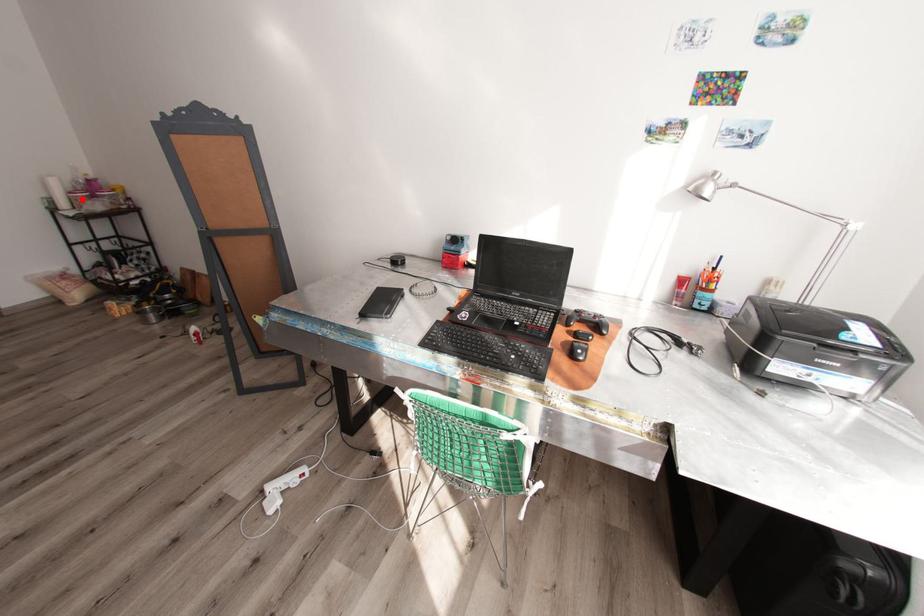
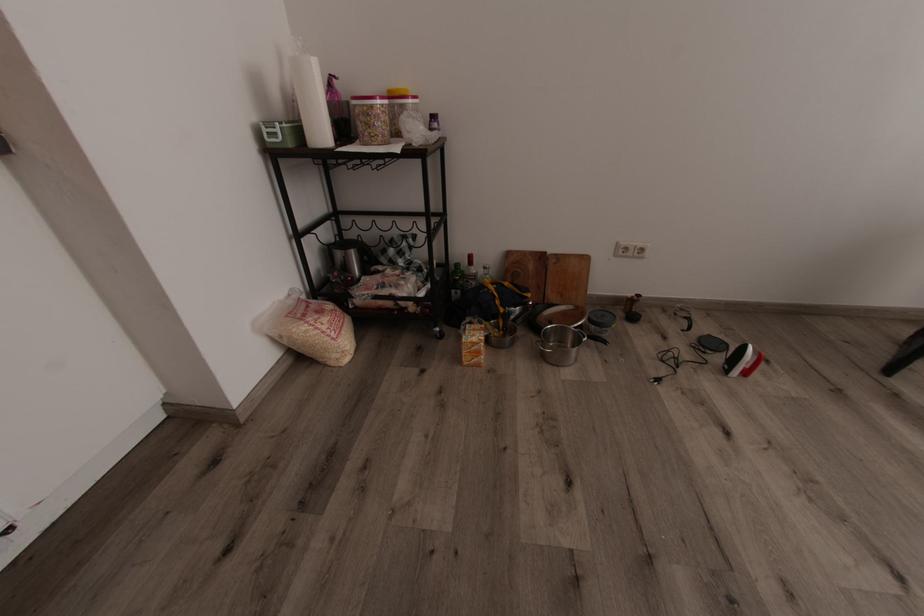
Question: I am providing you with two images of the same scene from different viewpoints. Given a red point in image1, look at the same physical point in image2. Is it:

Choices:
 (A) Closer to the viewpoint
 (B) Farther from the viewpoint

Answer: (A)